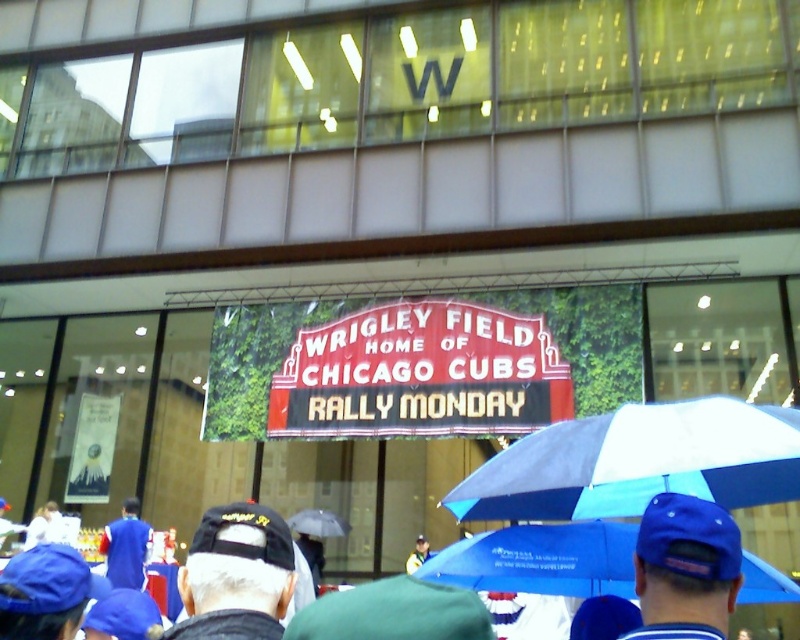
Does blue fabric umbrella at center have a smaller size compared to blue fabric cap at center?

No, blue fabric umbrella at center is not smaller than blue fabric cap at center.

Does point (708, 468) lie behind point (416, 557)?

No, it is in front of (416, 557).

The width and height of the screenshot is (800, 640). In order to click on blue fabric umbrella at center in this screenshot , I will do coord(638,461).

Between blue fabric umbrella at lower center and blue fabric jacket at lower left, which one is positioned higher?

blue fabric umbrella at lower center is above.

Does blue fabric umbrella at lower center come behind blue fabric jacket at lower left?

That is False.

Locate an element on the screen. The width and height of the screenshot is (800, 640). blue fabric umbrella at lower center is located at coordinates (541, 560).

Does blue fabric umbrella at lower center lie in front of black fabric cap at lower left?

No, blue fabric umbrella at lower center is further to the viewer.

Looking at this image, who is more distant from viewer, [792,593] or [214,531]?

The point [792,593] is behind.

Image resolution: width=800 pixels, height=640 pixels. What do you see at coordinates (541, 560) in the screenshot? I see `blue fabric umbrella at lower center` at bounding box center [541, 560].

Image resolution: width=800 pixels, height=640 pixels. In order to click on blue fabric umbrella at lower center in this screenshot , I will do 541,560.